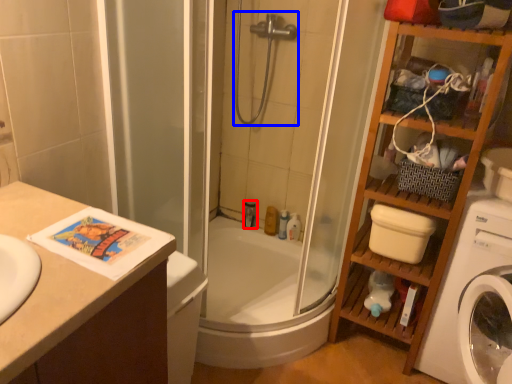
Question: Which object is closer to the camera taking this photo, toiletry (highlighted by a red box) or shower (highlighted by a blue box)?

Choices:
 (A) toiletry
 (B) shower

Answer: (B)